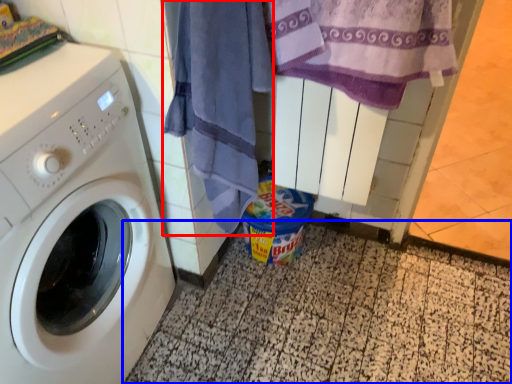
Question: Among these objects, which one is nearest to the camera, beach towel (highlighted by a red box) or tile (highlighted by a blue box)?

Choices:
 (A) beach towel
 (B) tile

Answer: (A)